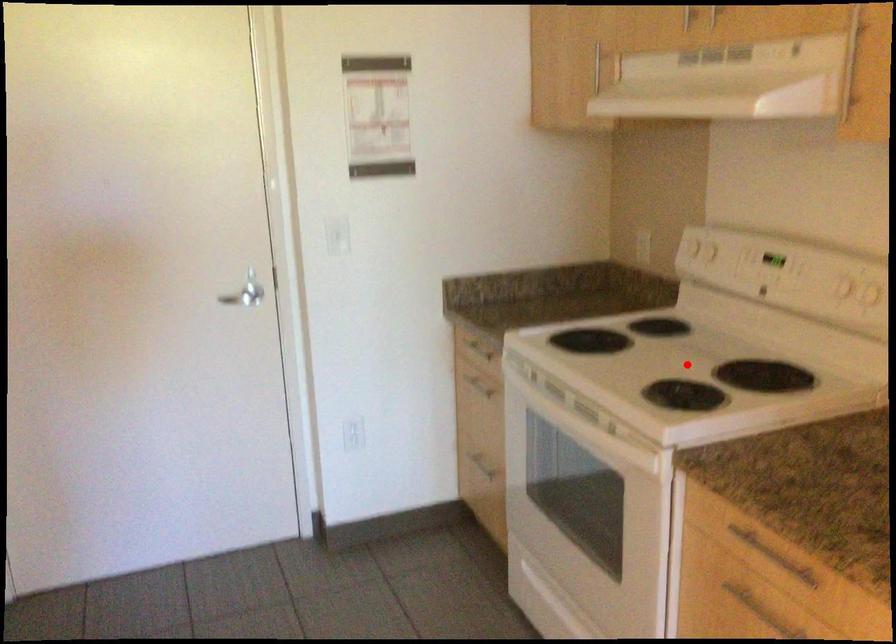
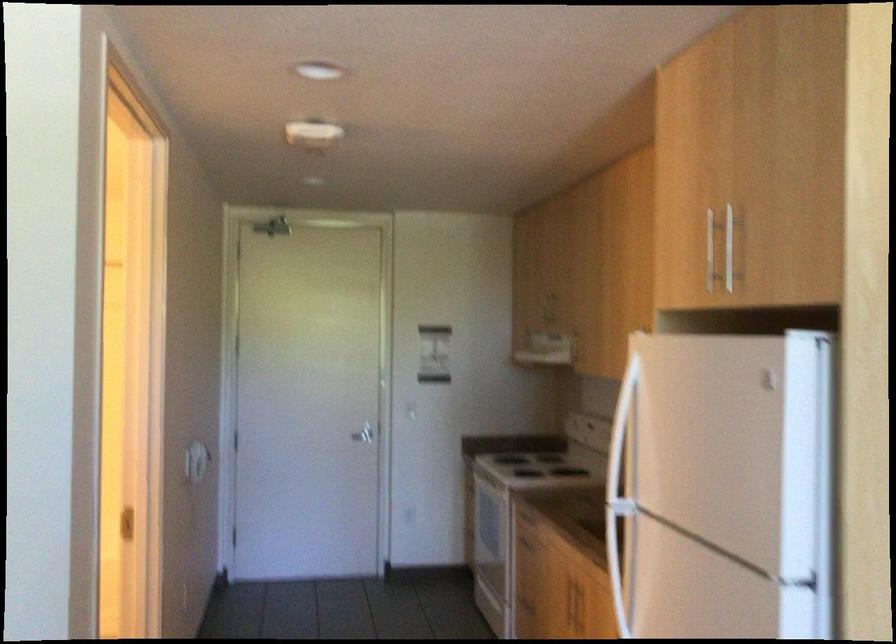
Question: I am providing you with two images of the same scene from different viewpoints. A red point is marked on the first image. At the location where the point appears in image 1, is it still visible in image 2?

Choices:
 (A) Yes
 (B) No

Answer: (B)